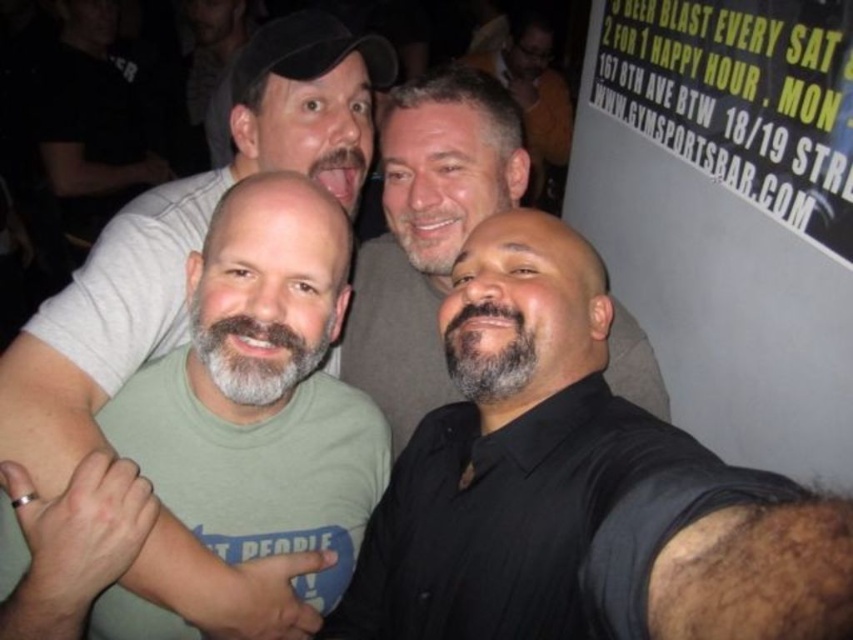
Between black shirt at center and gray beard at center, which one has less height?

black shirt at center is shorter.

Does point (621, 589) come closer to viewer compared to point (474, 112)?

That is True.

Where is `black shirt at center`? black shirt at center is located at coordinates (577, 486).

Consider the image. Who is shorter, black plastic signboard at upper right or gray beard at center?

With less height is gray beard at center.

Which is behind, point (688, 225) or point (432, 106)?

Positioned behind is point (688, 225).

What do you see at coordinates (729, 212) in the screenshot?
I see `black plastic signboard at upper right` at bounding box center [729, 212].

The image size is (853, 640). In order to click on black plastic signboard at upper right in this screenshot , I will do `click(729, 212)`.

Between point (608, 547) and point (254, 451), which one is positioned behind?

Point (254, 451)

Who is taller, black shirt at center or green cotton t-shirt at center?

green cotton t-shirt at center is taller.

Is point (467, 364) farther from viewer compared to point (270, 444)?

That is False.

Find the location of a particular element. This screenshot has height=640, width=853. black shirt at center is located at coordinates (577, 486).